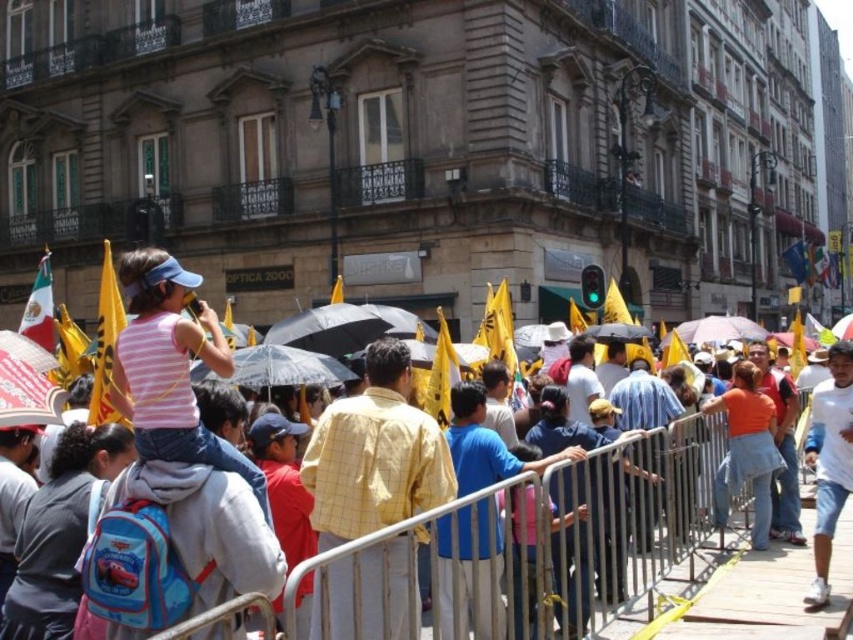
Question: Which point is closer to the camera?

Choices:
 (A) white cotton shirt at right
 (B) yellow fabric flag at upper left

Answer: (B)

Question: Is white cotton shirt at right below yellow fabric flag at upper left?

Choices:
 (A) yes
 (B) no

Answer: (A)

Question: Where is white cotton shirt at right located in relation to matte yellow flag at left in the image?

Choices:
 (A) below
 (B) above

Answer: (A)

Question: Which object is closer to the camera taking this photo?

Choices:
 (A) yellow checkered shirt at center
 (B) yellow fabric flag at upper left

Answer: (A)

Question: Is yellow checkered shirt at center thinner than matte yellow flag at left?

Choices:
 (A) yes
 (B) no

Answer: (A)

Question: Which is farther from the yellow fabric flag at upper left?

Choices:
 (A) yellow checkered shirt at center
 (B) matte yellow flag at left

Answer: (B)